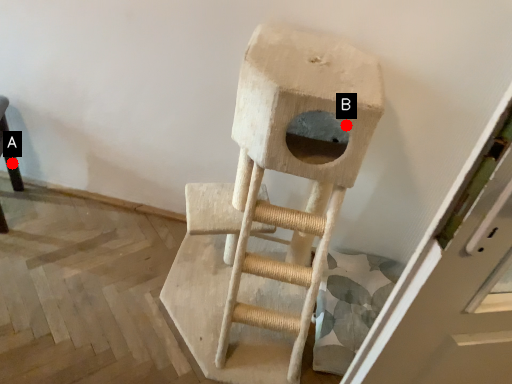
Question: Two points are circled on the image, labeled by A and B beside each circle. Which of the following is the closest to the observer?

Choices:
 (A) A is closer
 (B) B is closer

Answer: (B)